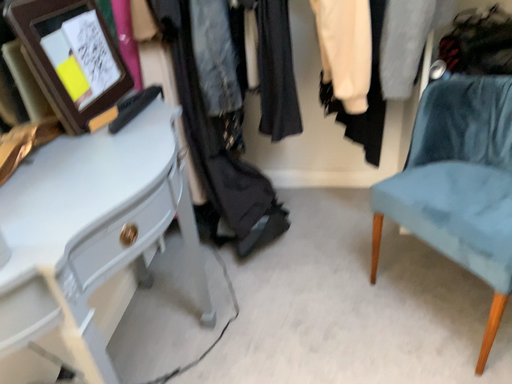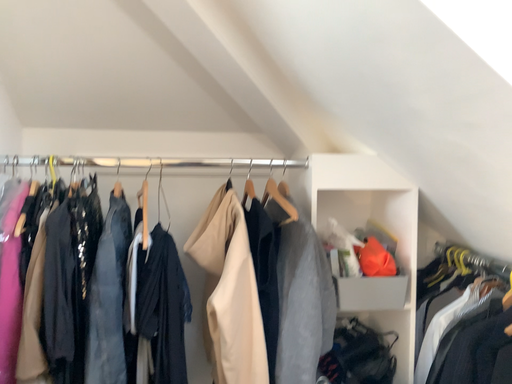
Question: How did the camera likely rotate when shooting the video?

Choices:
 (A) rotated left
 (B) rotated right

Answer: (B)